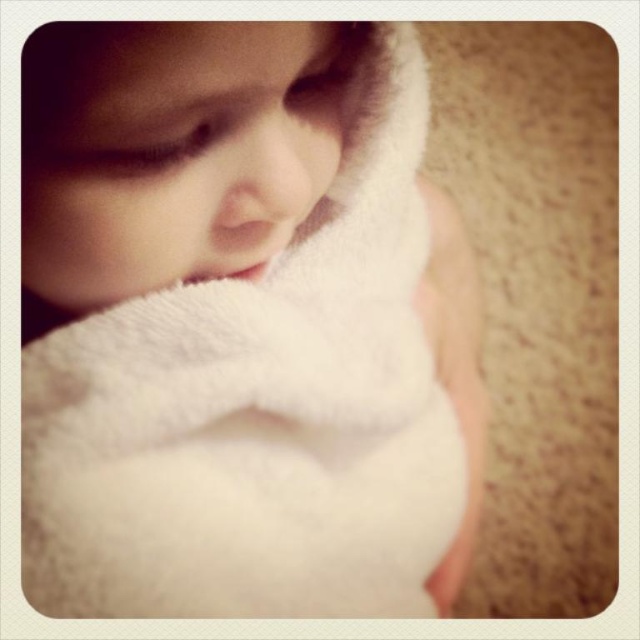
Based on the photo, you are taking a photo of a child in a white towel and notice two points in the image labeled as point (266,509) and point (36,54). Which point is closer to the camera?

Point (266,509) is further to the camera than point (36,54), so the point closer to the camera is point (36,54).

Based on the photo, you are a photographer setting up a shoot in a cozy room. You have two white fluffy towels in the scene. The white fluffy towel at upper left and the white fluffy towel at center. Which one is bigger?

The white fluffy towel at upper left is larger in size compared to the white fluffy towel at center.